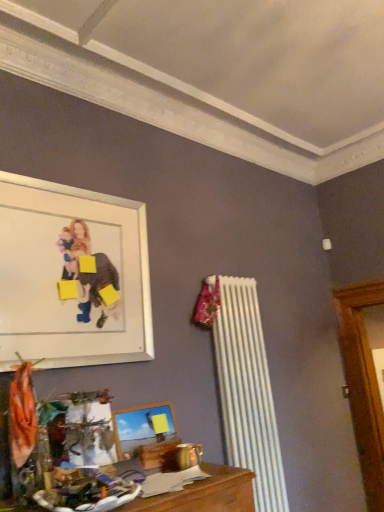
Question: Do you think white matte picture frame at upper left, marked as the first picture frame in a top-to-bottom arrangement, is within wooden picture frame at lower center, which ranks as the 2th picture frame in top-to-bottom order, or outside of it?

Choices:
 (A) inside
 (B) outside

Answer: (B)

Question: From the image's perspective, is white matte picture frame at upper left, marked as the first picture frame in a top-to-bottom arrangement, positioned above or below wooden picture frame at lower center, which is the 1th picture frame from bottom to top?

Choices:
 (A) below
 (B) above

Answer: (B)

Question: From a real-world perspective, is white matte picture frame at upper left, the second picture frame when ordered from bottom to top, above or below wooden picture frame at lower center, which ranks as the 2th picture frame in top-to-bottom order?

Choices:
 (A) above
 (B) below

Answer: (A)

Question: From the image's perspective, is wooden picture frame at lower center, which is the 1th picture frame from bottom to top, positioned above or below white matte picture frame at upper left, the second picture frame when ordered from bottom to top?

Choices:
 (A) above
 (B) below

Answer: (B)

Question: From their relative heights in the image, would you say wooden picture frame at lower center, which is the 1th picture frame from bottom to top, is taller or shorter than white matte picture frame at upper left, the second picture frame when ordered from bottom to top?

Choices:
 (A) tall
 (B) short

Answer: (B)

Question: In the image, is wooden picture frame at lower center, which is the 1th picture frame from bottom to top, on the left side or the right side of white matte picture frame at upper left, marked as the first picture frame in a top-to-bottom arrangement?

Choices:
 (A) right
 (B) left

Answer: (A)

Question: Is wooden picture frame at lower center, which ranks as the 2th picture frame in top-to-bottom order, wider or thinner than white matte picture frame at upper left, the second picture frame when ordered from bottom to top?

Choices:
 (A) wide
 (B) thin

Answer: (A)